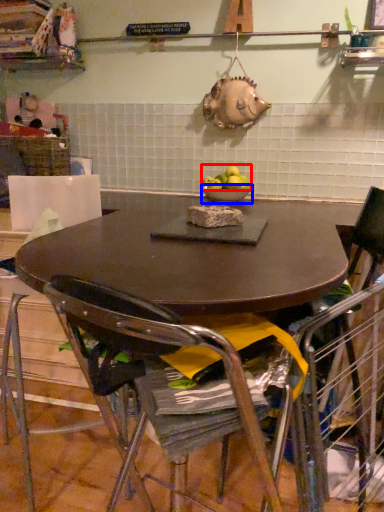
Question: Which object is closer to the camera taking this photo, apple (highlighted by a red box) or bowl (highlighted by a blue box)?

Choices:
 (A) apple
 (B) bowl

Answer: (A)